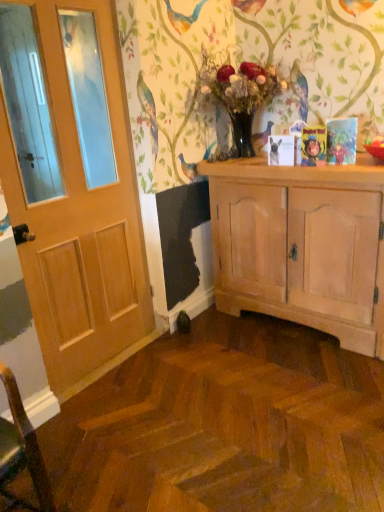
Question: Considering the relative sizes of wooden door at left and cartoon character book at upper right in the image provided, is wooden door at left thinner than cartoon character book at upper right?

Choices:
 (A) no
 (B) yes

Answer: (A)

Question: Can you confirm if wooden door at left is positioned to the left of cartoon character book at upper right?

Choices:
 (A) yes
 (B) no

Answer: (A)

Question: Considering the relative sizes of wooden door at left and cartoon character book at upper right in the image provided, is wooden door at left wider than cartoon character book at upper right?

Choices:
 (A) no
 (B) yes

Answer: (B)

Question: Can you confirm if wooden door at left is smaller than cartoon character book at upper right?

Choices:
 (A) no
 (B) yes

Answer: (A)

Question: Does wooden door at left have a larger size compared to cartoon character book at upper right?

Choices:
 (A) yes
 (B) no

Answer: (A)

Question: From the image's perspective, is wooden door at left above cartoon character book at upper right?

Choices:
 (A) yes
 (B) no

Answer: (B)

Question: From a real-world perspective, is cartoon character book at upper right positioned over translucent glass vase at center based on gravity?

Choices:
 (A) yes
 (B) no

Answer: (B)

Question: Is cartoon character book at upper right at the left side of translucent glass vase at center?

Choices:
 (A) no
 (B) yes

Answer: (A)

Question: Does cartoon character book at upper right have a smaller size compared to translucent glass vase at center?

Choices:
 (A) no
 (B) yes

Answer: (B)

Question: Does cartoon character book at upper right lie in front of translucent glass vase at center?

Choices:
 (A) yes
 (B) no

Answer: (A)

Question: Can you confirm if cartoon character book at upper right is wider than translucent glass vase at center?

Choices:
 (A) no
 (B) yes

Answer: (A)

Question: Does cartoon character book at upper right appear on the right side of translucent glass vase at center?

Choices:
 (A) yes
 (B) no

Answer: (A)

Question: Does matte white dog at center have a lesser width compared to cartoon character book at upper right?

Choices:
 (A) yes
 (B) no

Answer: (A)